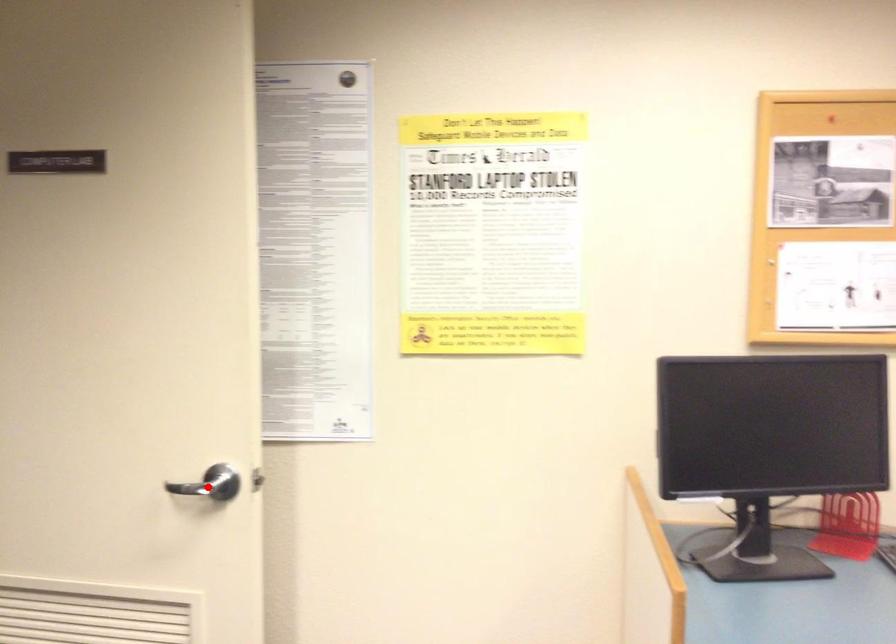
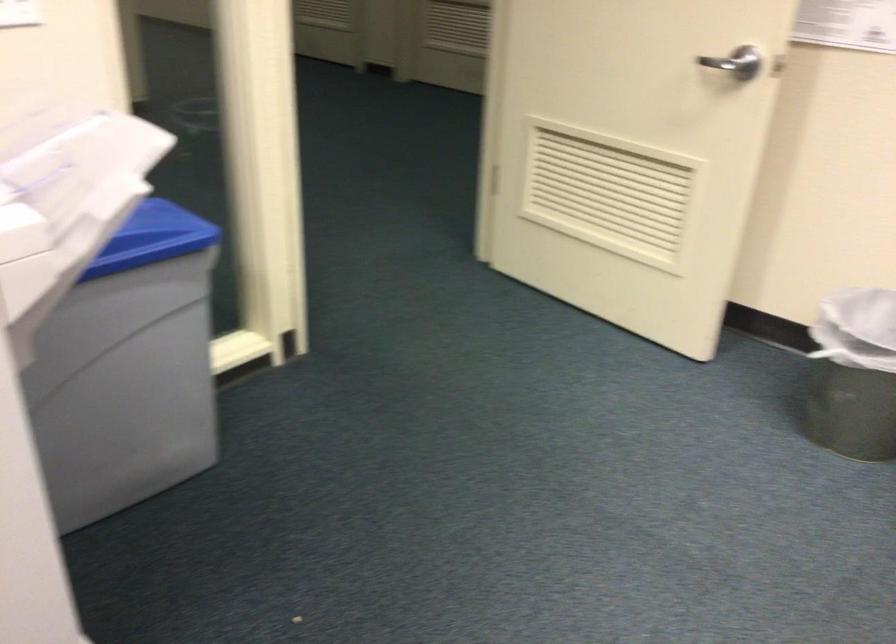
Where in the second image is the point corresponding to the highlighted location from the first image?

(736, 62)